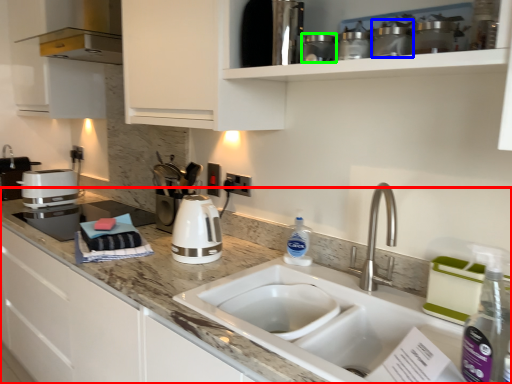
Question: Which object is positioned closest to countertop (highlighted by a red box)? Select from appliance (highlighted by a blue box) and appliance (highlighted by a green box).

Choices:
 (A) appliance
 (B) appliance

Answer: (B)